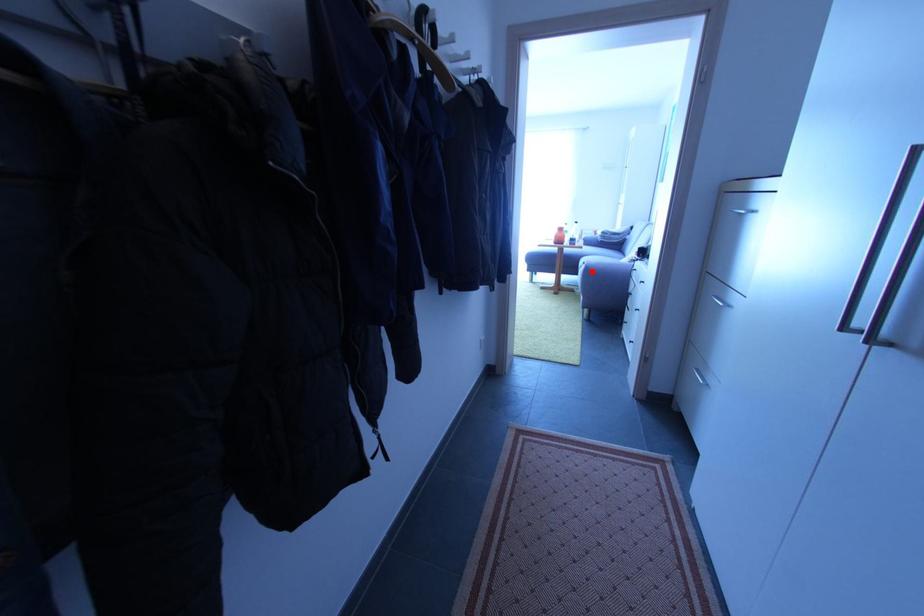
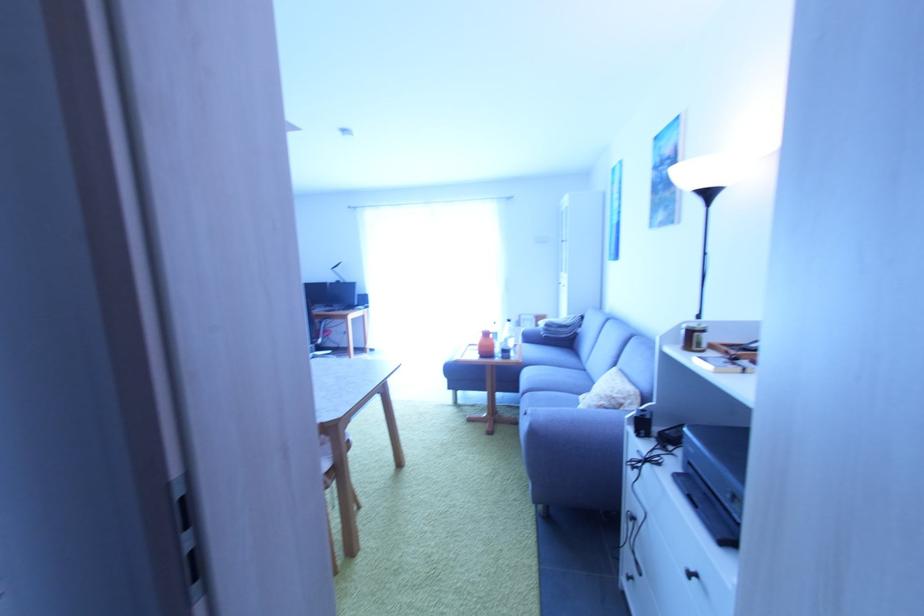
Where in the second image is the point corresponding to the highlighted location from the first image?

(538, 435)